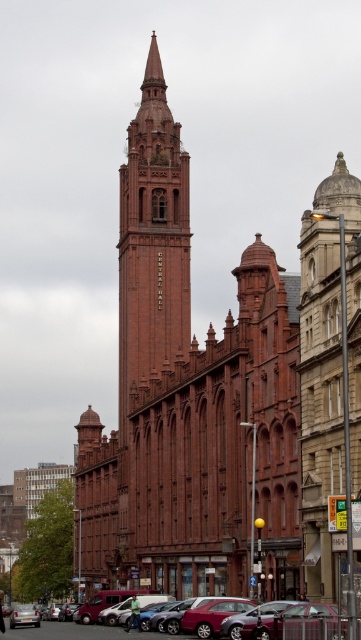
Which is below, brick tower at center or metallic silver car at lower center?

metallic silver car at lower center

Is brick tower at center positioned before metallic silver car at lower center?

No, brick tower at center is behind metallic silver car at lower center.

The height and width of the screenshot is (640, 361). I want to click on brick tower at center, so click(x=151, y=243).

Identify the location of brick tower at center. (151, 243).

From the picture: Is stone dome at center positioned behind brick tower at center?

No.

Which is behind, point (319, 340) or point (167, 157)?

The point (167, 157) is behind.

You are a GUI agent. You are given a task and a screenshot of the screen. Output one action in this format:
    pyautogui.click(x=<x>, y=<y>)
    Task: Click on the stone dome at center
    The image size is (361, 640).
    Given the screenshot: What is the action you would take?
    pyautogui.click(x=328, y=372)

Is metallic silver car at lower center below metallic silver car at lower left?

Actually, metallic silver car at lower center is above metallic silver car at lower left.

Find the location of a particular element. Image resolution: width=361 pixels, height=640 pixels. metallic silver car at lower center is located at coordinates (80, 632).